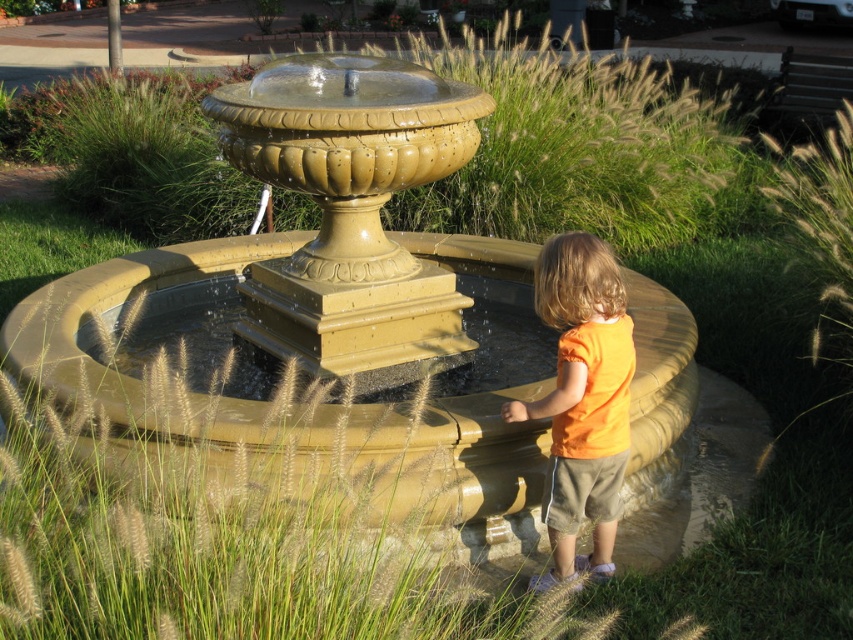
Based on the photo, you are a photographer trying to capture a clear shot of the matte gold fountain at center and the orange cotton shirt at right. Since you want both subjects in focus, which one should you focus on first to ensure proper depth of field?

The matte gold fountain at center is located above the orange cotton shirt at right, so focusing on the matte gold fountain at center first will help ensure both are in focus as it is farther away.

You are a photographer trying to capture the matte gold fountain at center and the orange cotton shirt at right in the same frame. Considering their sizes, which object will appear larger in the photo?

The matte gold fountain at center will appear larger in the photo because it is much taller than the orange cotton shirt at right.

You are a photographer wanting to capture the matte gold fountain at center and the orange cotton shirt at right in the same frame. Given their sizes, which object should you focus on to ensure both are clearly visible in the photo?

Since the matte gold fountain at center is larger than the orange cotton shirt at right, you should focus on the matte gold fountain at center to ensure both are clearly visible in the photo.